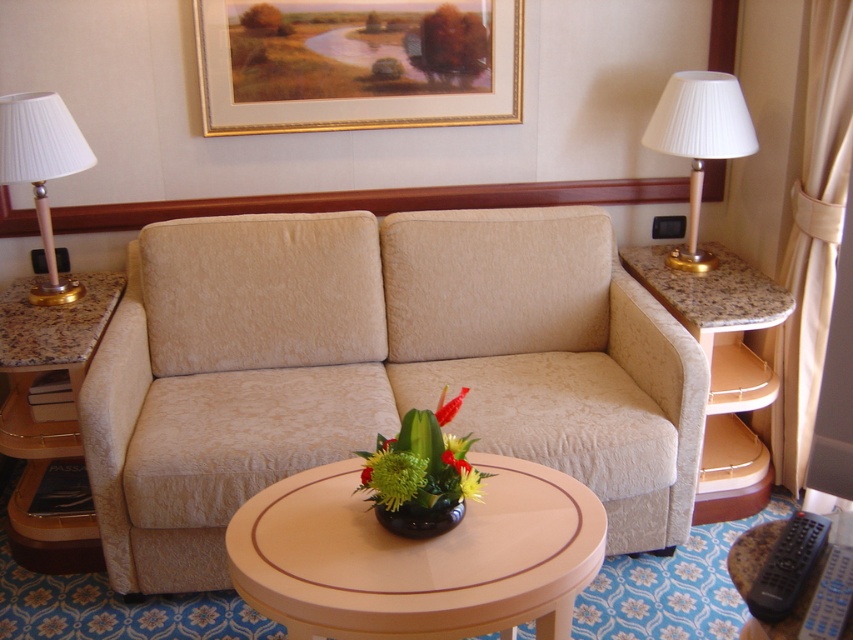
Is gold-framed painting at upper center further to the viewer compared to wooden round table at center?

Yes, it is.

Between point (334, 42) and point (759, 547), which one is positioned in front?

Positioned in front is point (759, 547).

The width and height of the screenshot is (853, 640). What do you see at coordinates (357, 65) in the screenshot?
I see `gold-framed painting at upper center` at bounding box center [357, 65].

This screenshot has width=853, height=640. What are the coordinates of `gold-framed painting at upper center` in the screenshot? It's located at (357, 65).

What do you see at coordinates (421, 516) in the screenshot?
I see `matte black vase at center` at bounding box center [421, 516].

Which of these two, matte black vase at center or green fabric flower at center, stands shorter?

Standing shorter between the two is green fabric flower at center.

Does point (425, 508) come behind point (461, 394)?

No, (425, 508) is in front of (461, 394).

At what (x,y) coordinates should I click in order to perform the action: click on matte black vase at center. Please return your answer as a coordinate pair (x, y). This screenshot has height=640, width=853. Looking at the image, I should click on (421, 516).

Which is in front, point (447, 554) or point (415, 508)?

Point (447, 554) is in front.

Is matte beige table at center thinner than matte black vase at center?

Incorrect, matte beige table at center's width is not less than matte black vase at center's.

Does point (291, 483) come in front of point (381, 515)?

No, it is not.

I want to click on matte beige table at center, so click(x=416, y=556).